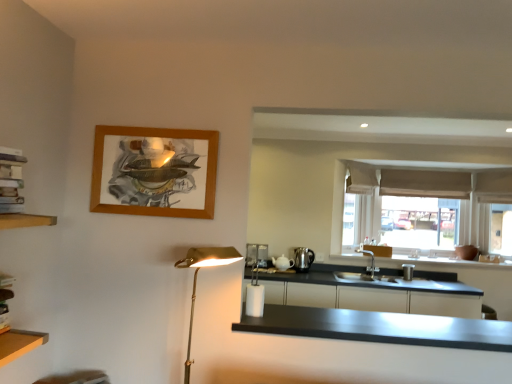
Question: From the image's perspective, is satin silver kettle at right, which ranks as the 2th appliance in left-to-right order, beneath black matte countertop at center?

Choices:
 (A) no
 (B) yes

Answer: (B)

Question: Would you say satin silver kettle at right, which ranks as the 2th appliance in left-to-right order, is outside black matte countertop at center?

Choices:
 (A) no
 (B) yes

Answer: (B)

Question: Is there a large distance between satin silver kettle at right, which is the first appliance in right-to-left order, and black matte countertop at center?

Choices:
 (A) no
 (B) yes

Answer: (B)

Question: Can you confirm if satin silver kettle at right, which ranks as the 2th appliance in left-to-right order, is positioned to the right of black matte countertop at center?

Choices:
 (A) yes
 (B) no

Answer: (B)

Question: Is satin silver kettle at right, which is the first appliance in right-to-left order, positioned before black matte countertop at center?

Choices:
 (A) yes
 (B) no

Answer: (B)

Question: Based on their sizes in the image, would you say white cardboard books at left is bigger or smaller than wooden frame at upper left?

Choices:
 (A) big
 (B) small

Answer: (B)

Question: From a real-world perspective, is white cardboard books at left physically located above or below wooden frame at upper left?

Choices:
 (A) below
 (B) above

Answer: (A)

Question: Is point (1, 228) closer or farther from the camera than point (142, 155)?

Choices:
 (A) closer
 (B) farther

Answer: (A)

Question: Considering the positions of white cardboard books at left and wooden frame at upper left in the image, is white cardboard books at left wider or thinner than wooden frame at upper left?

Choices:
 (A) wide
 (B) thin

Answer: (A)

Question: From a real-world perspective, relative to gold metallic floor lamp at left, is black matte countertop at center vertically above or below?

Choices:
 (A) below
 (B) above

Answer: (A)

Question: Based on their sizes in the image, would you say black matte countertop at center is bigger or smaller than gold metallic floor lamp at left?

Choices:
 (A) small
 (B) big

Answer: (A)

Question: Considering their positions, is black matte countertop at center located in front of or behind gold metallic floor lamp at left?

Choices:
 (A) front
 (B) behind

Answer: (B)

Question: From the image's perspective, is black matte countertop at center above or below gold metallic floor lamp at left?

Choices:
 (A) below
 (B) above

Answer: (A)

Question: Is matte black cabinetry at lower right wider or thinner than beige fabric curtain at upper right?

Choices:
 (A) wide
 (B) thin

Answer: (A)

Question: Based on their sizes in the image, would you say matte black cabinetry at lower right is bigger or smaller than beige fabric curtain at upper right?

Choices:
 (A) small
 (B) big

Answer: (B)